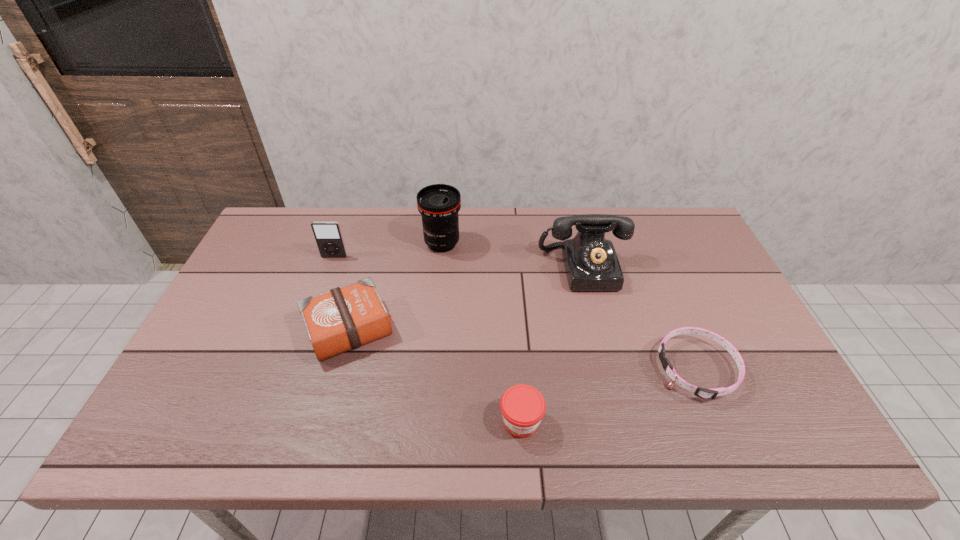
The image size is (960, 540). Identify the location of telephoto lens. (439, 204).

At what (x,y) coordinates should I click in order to perform the action: click on telephone. Please return your answer as a coordinate pair (x, y). The image size is (960, 540). Looking at the image, I should click on point(591,263).

Locate an element on the screen. Image resolution: width=960 pixels, height=540 pixels. iPod is located at coordinates (328, 236).

You are a GUI agent. You are given a task and a screenshot of the screen. Output one action in this format:
    pyautogui.click(x=<x>, y=<y>)
    Task: Click on the Bible
    The height and width of the screenshot is (540, 960).
    Given the screenshot: What is the action you would take?
    pyautogui.click(x=344, y=318)

Locate an element on the screen. The width and height of the screenshot is (960, 540). the third object from right to left is located at coordinates (522, 406).

This screenshot has width=960, height=540. I want to click on dog collar, so click(x=704, y=393).

Locate an element on the screen. free location located 0.100m on the back of the telephoto lens is located at coordinates (445, 214).

Image resolution: width=960 pixels, height=540 pixels. Find the location of `blank space located 0.400m on the dial of the telephone`. blank space located 0.400m on the dial of the telephone is located at coordinates (622, 422).

Find the location of a particular element. The width and height of the screenshot is (960, 540). vacant space situated on the front-facing side of the third tallest object is located at coordinates (321, 295).

At what (x,y) coordinates should I click in order to perform the action: click on free space located on the right of the Bible. Please return your answer as a coordinate pair (x, y). This screenshot has width=960, height=540. Looking at the image, I should click on click(523, 329).